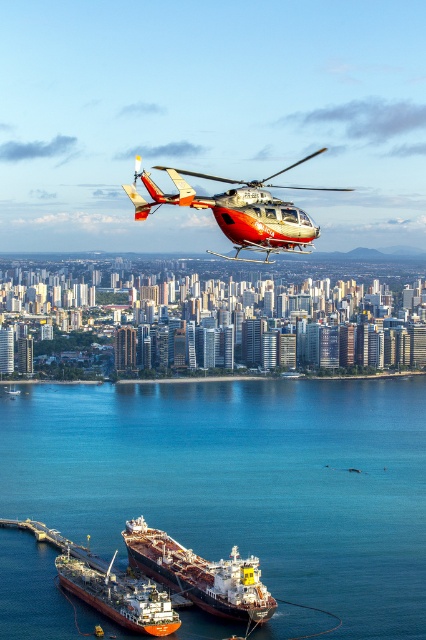
Between metallic silver helicopter at center and red matte tanker ship at lower center, which one is positioned lower?

red matte tanker ship at lower center

The width and height of the screenshot is (426, 640). Describe the element at coordinates (238, 209) in the screenshot. I see `metallic silver helicopter at center` at that location.

Locate an element on the screen. The width and height of the screenshot is (426, 640). metallic silver helicopter at center is located at coordinates (238, 209).

Locate an element on the screen. This screenshot has width=426, height=640. metallic silver helicopter at center is located at coordinates (238, 209).

Based on the photo, does metallic silver helicopter at center have a smaller size compared to brown matte cargo ship at lower center?

No, metallic silver helicopter at center is not smaller than brown matte cargo ship at lower center.

Between metallic silver helicopter at center and brown matte cargo ship at lower center, which one has less height?

Standing shorter between the two is brown matte cargo ship at lower center.

At what (x,y) coordinates should I click in order to perform the action: click on metallic silver helicopter at center. Please return your answer as a coordinate pair (x, y). Looking at the image, I should click on (238, 209).

Which is behind, point (45, 493) or point (203, 204)?

The point (45, 493) is more distant.

Does point (224, 490) come behind point (157, 209)?

Yes, it is.

Identify the location of blue water at lower center. (241, 481).